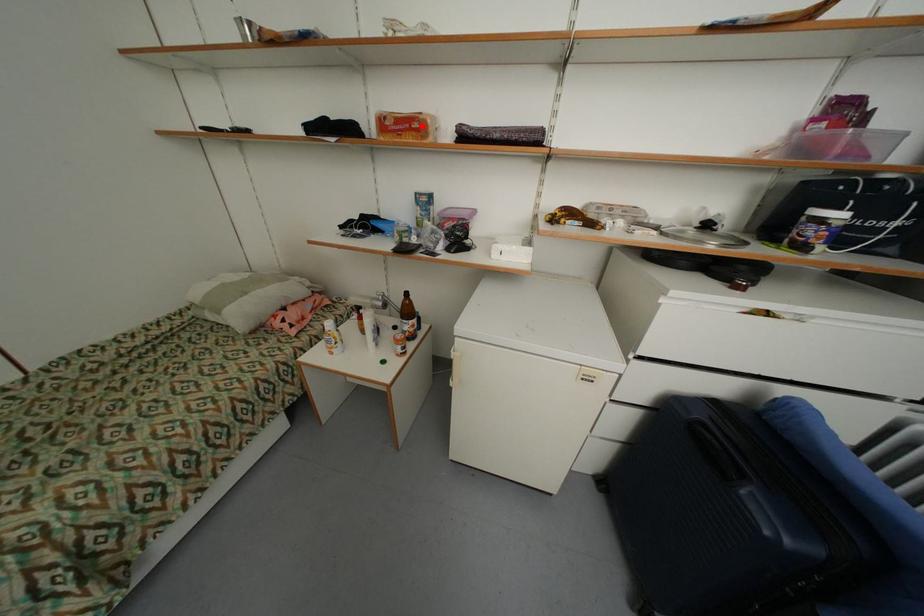
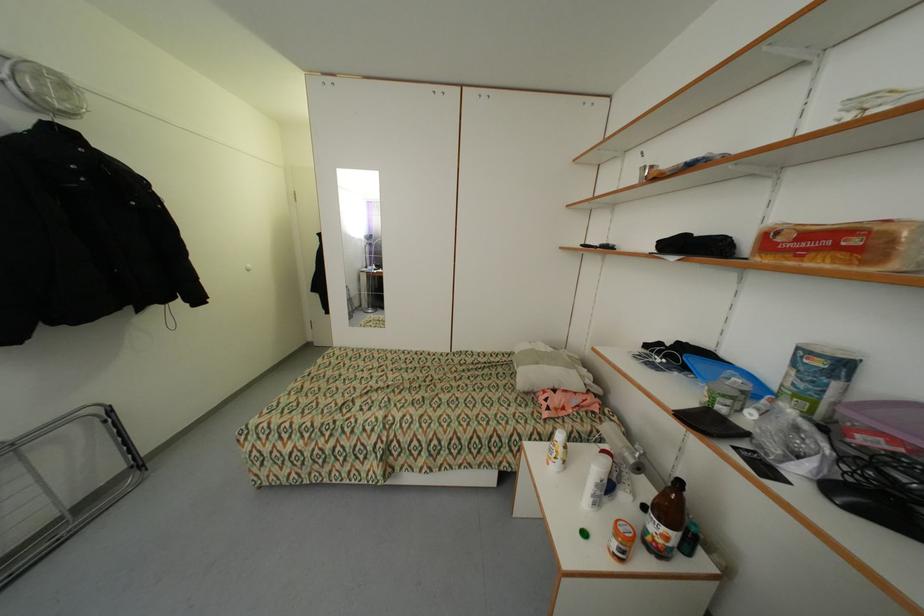
Find the pixel in the second image that matches the highlighted location in the first image.

(860, 241)